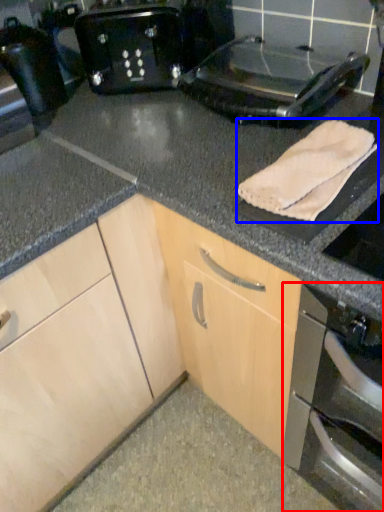
Question: Which point is closer to the camera, home appliance (highlighted by a red box) or bath towel (highlighted by a blue box)?

Choices:
 (A) home appliance
 (B) bath towel

Answer: (A)